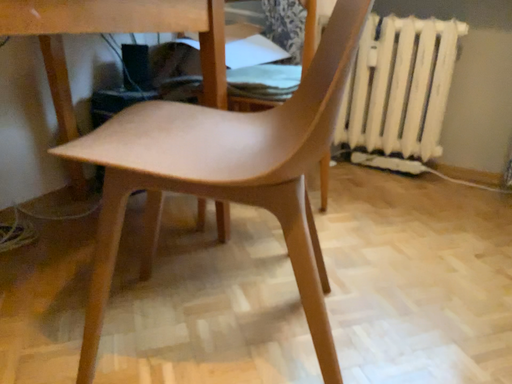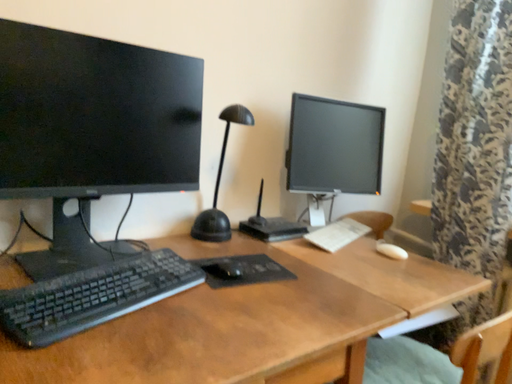
Question: Which way did the camera rotate in the video?

Choices:
 (A) rotated downward
 (B) rotated upward

Answer: (B)